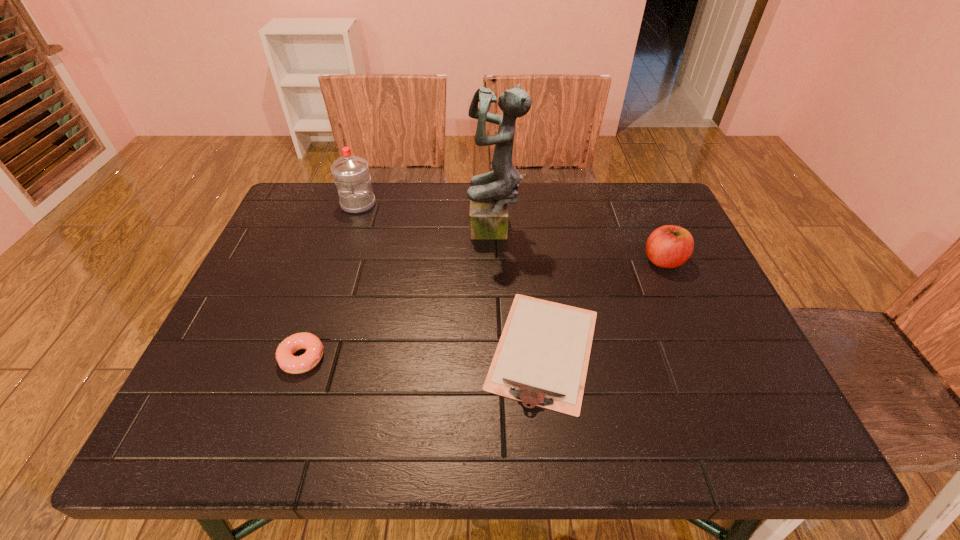
Where is `the tallest object`? This screenshot has width=960, height=540. the tallest object is located at coordinates (490, 193).

Locate an element on the screen. This screenshot has height=540, width=960. the fourth shortest object is located at coordinates tap(351, 174).

Locate an element on the screen. This screenshot has height=540, width=960. water bottle is located at coordinates (351, 174).

The width and height of the screenshot is (960, 540). I want to click on the third tallest object, so click(x=669, y=246).

The height and width of the screenshot is (540, 960). What are the coordinates of `apple` in the screenshot? It's located at [669, 246].

Where is `the second shortest object`? the second shortest object is located at coordinates (289, 363).

Locate an element on the screen. The height and width of the screenshot is (540, 960). the shortest object is located at coordinates (542, 357).

Find the location of `free space located on the face of the sculpture`. free space located on the face of the sculpture is located at coordinates (396, 231).

At what (x,y) coordinates should I click in order to perform the action: click on free space located 0.220m on the face of the sculpture. Please return your answer as a coordinate pair (x, y). This screenshot has height=540, width=960. Looking at the image, I should click on (390, 231).

What are the coordinates of `free spot located on the face of the sculpture` in the screenshot? It's located at (336, 231).